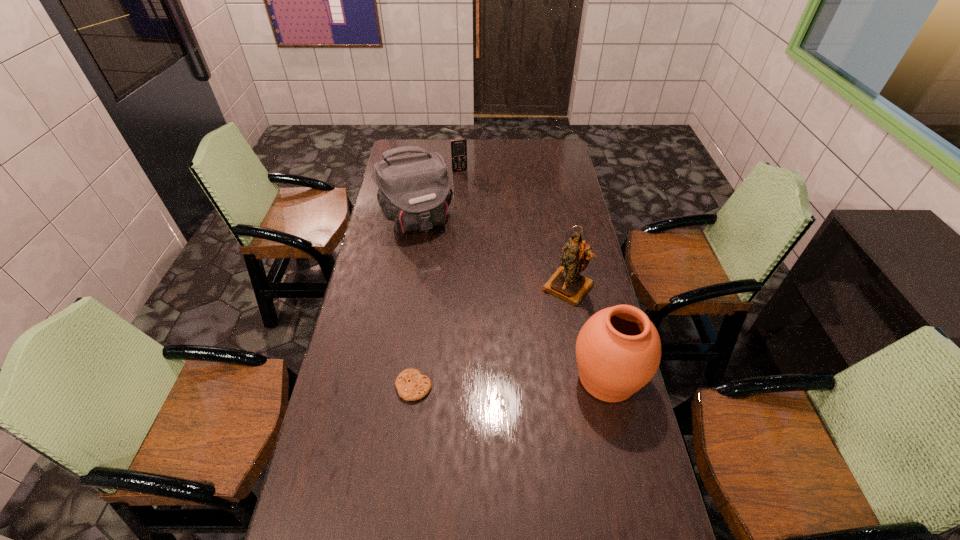
At what (x,y) coordinates should I click in order to perform the action: click on vacant space located on the front-facing side of the figurine. Please return your answer as a coordinate pair (x, y). This screenshot has width=960, height=540. Looking at the image, I should click on (504, 361).

Image resolution: width=960 pixels, height=540 pixels. In order to click on blank space located 0.120m on the front-facing side of the figurine in this screenshot , I will do 536,323.

I want to click on free location located 0.110m on the open flap of the second farthest object, so [x=435, y=259].

Locate an element on the screen. vacant region located on the open flap of the second farthest object is located at coordinates (449, 291).

The height and width of the screenshot is (540, 960). Find the location of `free location located on the open flap of the second farthest object`. free location located on the open flap of the second farthest object is located at coordinates [433, 255].

In order to click on free space located 0.340m on the screen of the cellular telephone in this screenshot , I will do `click(477, 215)`.

Identify the location of blank area located on the screen of the cellular telephone. (476, 213).

This screenshot has height=540, width=960. I want to click on vacant space located on the screen of the cellular telephone, so click(467, 186).

You are a GUI agent. You are given a task and a screenshot of the screen. Output one action in this format:
    pyautogui.click(x=<x>, y=<y>)
    Task: Click on the object positioned at the left edge
    The width and height of the screenshot is (960, 540).
    Given the screenshot: What is the action you would take?
    pyautogui.click(x=414, y=191)

You are a GUI agent. You are given a task and a screenshot of the screen. Output one action in this format:
    pyautogui.click(x=<x>, y=<y>)
    Task: Click on the urn present at the right edge
    
    Given the screenshot: What is the action you would take?
    tap(618, 350)